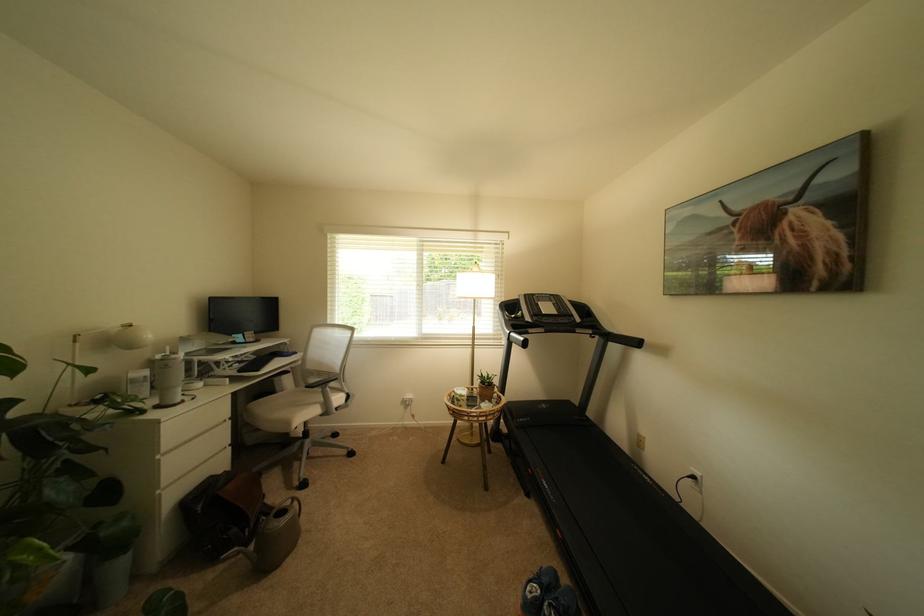
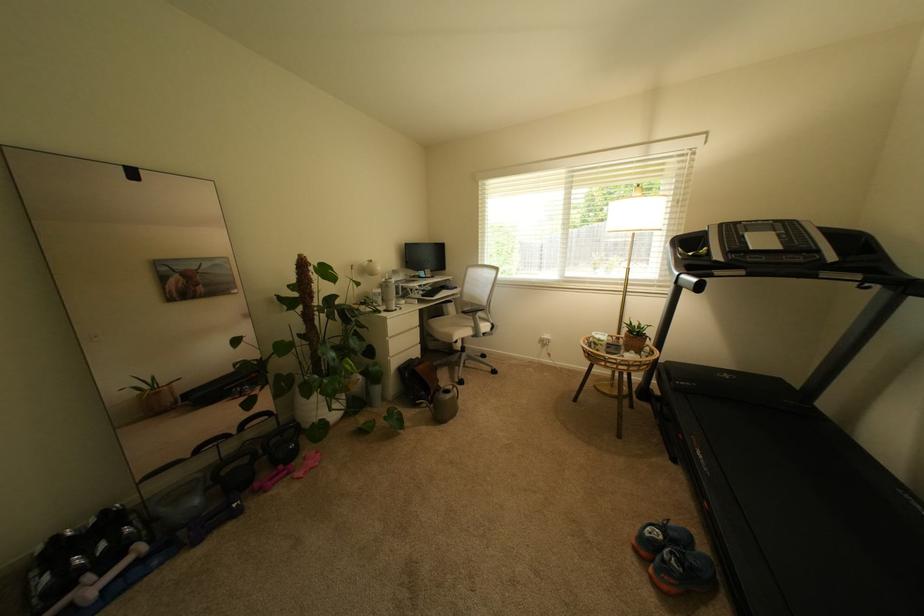
The point at (165,403) is marked in the first image. Where is the corresponding point in the second image?

(393, 310)